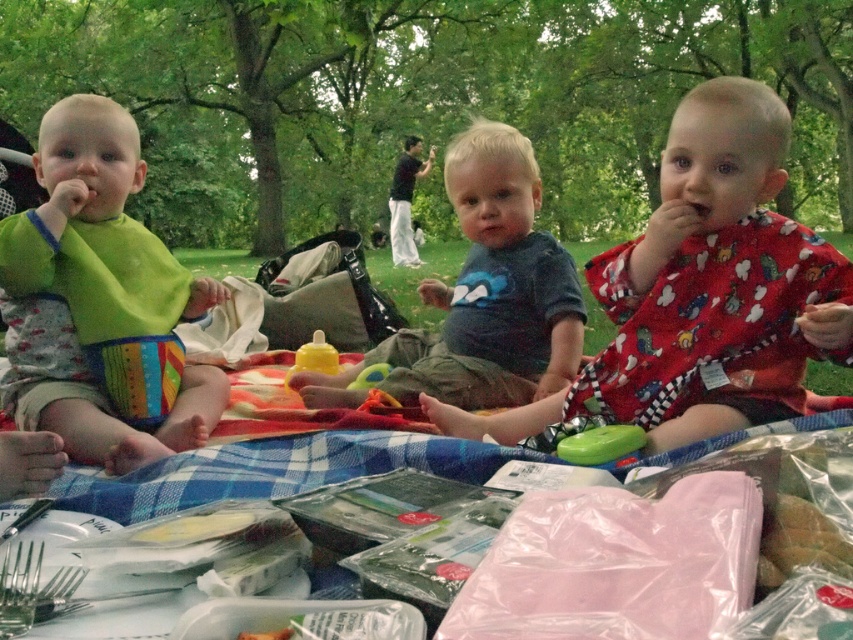
You are standing 10 feet away from the picnic blanket. You want to pick up the green plastic toy at center without moving your feet. Can you reach it?

The green plastic toy at center is 5.12 feet away from the camera. Since you are standing 10 feet away from the picnic blanket, the total distance between you and the green plastic toy at center is more than 10 feet. Therefore, you cannot reach it without moving your feet.

You are standing at the picnic area and want to pick up an item from the picnic blanket. If you have to choose between the item at point (109, 260) and the item at point (360, 376), which one would you reach first without moving your feet?

You would reach the item at point (109, 260) first because it is closer to you than the item at point (360, 376).